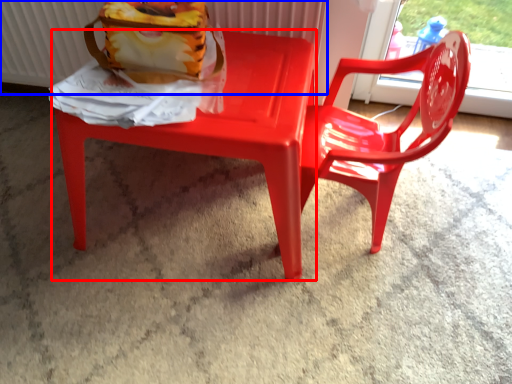
Question: Which point is closer to the camera, chair (highlighted by a red box) or radiator (highlighted by a blue box)?

Choices:
 (A) chair
 (B) radiator

Answer: (A)